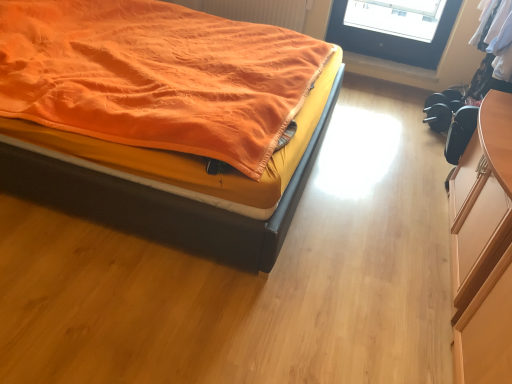
Image resolution: width=512 pixels, height=384 pixels. Identify the location of orange fabric radiator at upper center. (255, 10).

What do you see at coordinates (186, 171) in the screenshot?
I see `orange fabric bed at upper left` at bounding box center [186, 171].

Locate an element on the screen. wooden at lower right is located at coordinates (390, 71).

Locate an element on the screen. Image resolution: width=512 pixels, height=384 pixels. orange fabric radiator at upper center is located at coordinates (255, 10).

Based on the photo, who is smaller, orange fabric radiator at upper center or wooden at lower right?

With smaller size is wooden at lower right.

Measure the distance from orange fabric radiator at upper center to wooden at lower right.

They are 29.41 inches apart.

Is orange fabric radiator at upper center outside of wooden at lower right?

Indeed, orange fabric radiator at upper center is completely outside wooden at lower right.

Can you confirm if orange fabric radiator at upper center is thinner than wooden at lower right?

Yes.

Is wooden at lower right taller than orange fabric bed at upper left?

In fact, wooden at lower right may be shorter than orange fabric bed at upper left.

Between wooden at lower right and orange fabric bed at upper left, which one has larger width?

With larger width is orange fabric bed at upper left.

Is wooden at lower right turned away from orange fabric bed at upper left?

No, orange fabric bed at upper left is not at the back of wooden at lower right.

In the image, there is a orange fabric bed at upper left. Where is `window sill below it (from a real-world perspective)`? This screenshot has height=384, width=512. window sill below it (from a real-world perspective) is located at coordinates (390, 71).

The image size is (512, 384). I want to click on bed in front of the orange fabric radiator at upper center, so click(186, 171).

Is orange fabric bed at upper left far away from orange fabric radiator at upper center?

Indeed, orange fabric bed at upper left is not near orange fabric radiator at upper center.

Looking at this image, which of these two, orange fabric bed at upper left or orange fabric radiator at upper center, is smaller?

orange fabric radiator at upper center is smaller.

Based on the photo, from a real-world perspective, who is located lower, orange fabric bed at upper left or orange fabric radiator at upper center?

orange fabric radiator at upper center is physically lower.

I want to click on window sill that is behind the orange fabric bed at upper left, so click(x=390, y=71).

Based on their positions, is orange fabric bed at upper left located to the left or right of wooden at lower right?

In the image, orange fabric bed at upper left appears on the left side of wooden at lower right.

Is orange fabric radiator at upper center at the back of wooden at lower right?

No, orange fabric radiator at upper center is not at the back of wooden at lower right.

Which is closer, (x=426, y=81) or (x=289, y=28)?

Point (x=426, y=81) appears to be farther away from the viewer than point (x=289, y=28).

The image size is (512, 384). Identify the location of window sill behind the orange fabric radiator at upper center. (390, 71).

Which object is wider, wooden at lower right or orange fabric radiator at upper center?

wooden at lower right is wider.

From a real-world perspective, is orange fabric radiator at upper center physically located above or below orange fabric bed at upper left?

From a real-world perspective, orange fabric radiator at upper center is physically below orange fabric bed at upper left.

Which is closer, (238, 0) or (206, 235)?

Point (238, 0) appears to be farther away from the viewer than point (206, 235).

Is orange fabric radiator at upper center further to camera compared to orange fabric bed at upper left?

That is True.

Looking at this image, is orange fabric bed at upper left completely or partially inside orange fabric radiator at upper center?

No, orange fabric bed at upper left is not inside orange fabric radiator at upper center.

Find the location of a particular element. This screenshot has width=512, height=384. window sill lying below the orange fabric radiator at upper center (from the image's perspective) is located at coordinates (390, 71).

At what (x,y) coordinates should I click in order to perform the action: click on bed in front of the wooden at lower right. Please return your answer as a coordinate pair (x, y). The height and width of the screenshot is (384, 512). Looking at the image, I should click on (186, 171).

Looking at the image, which one is located closer to orange fabric bed at upper left, orange fabric radiator at upper center or wooden at lower right?

Based on the image, orange fabric radiator at upper center appears to be nearer to orange fabric bed at upper left.

In the scene shown: From the image, which object appears to be nearer to orange fabric radiator at upper center, wooden at lower right or orange fabric bed at upper left?

wooden at lower right.

Based on their spatial positions, is orange fabric radiator at upper center or orange fabric bed at upper left closer to wooden at lower right?

orange fabric radiator at upper center lies closer to wooden at lower right than the other object.

In the scene shown: Considering their positions, is orange fabric bed at upper left positioned closer to wooden at lower right than orange fabric radiator at upper center?

orange fabric radiator at upper center lies closer to wooden at lower right than the other object.

Estimate the real-world distances between objects in this image. Which object is closer to orange fabric radiator at upper center, orange fabric bed at upper left or wooden at lower right?

wooden at lower right is positioned closer to the anchor orange fabric radiator at upper center.

From the image, which object appears to be farther from orange fabric bed at upper left, wooden at lower right or orange fabric radiator at upper center?

wooden at lower right is further to orange fabric bed at upper left.

The image size is (512, 384). Find the location of `radiator positioned between orange fabric bed at upper left and wooden at lower right from near to far`. radiator positioned between orange fabric bed at upper left and wooden at lower right from near to far is located at coordinates (255, 10).